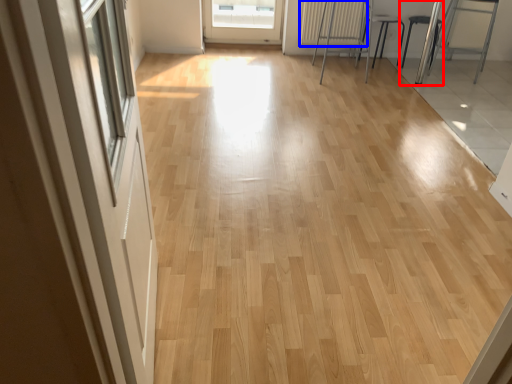
Question: Which of the following is the farthest to the observer, armchair (highlighted by a red box) or radiator (highlighted by a blue box)?

Choices:
 (A) armchair
 (B) radiator

Answer: (B)